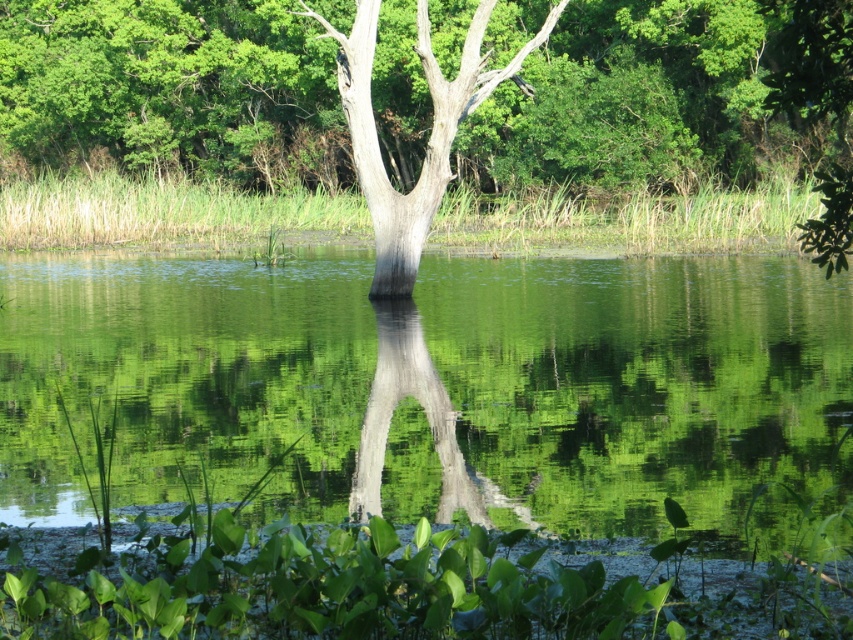
You are an environmental scientist assessing the health of this natural area. You observe two trees at the center of the scene, the smooth bark tree at center and the smooth gray tree at center. Which tree would you prioritize for further study based on its size?

The smooth bark tree at center is bigger than the smooth gray tree at center, so it would be prioritized for further study due to its larger size.